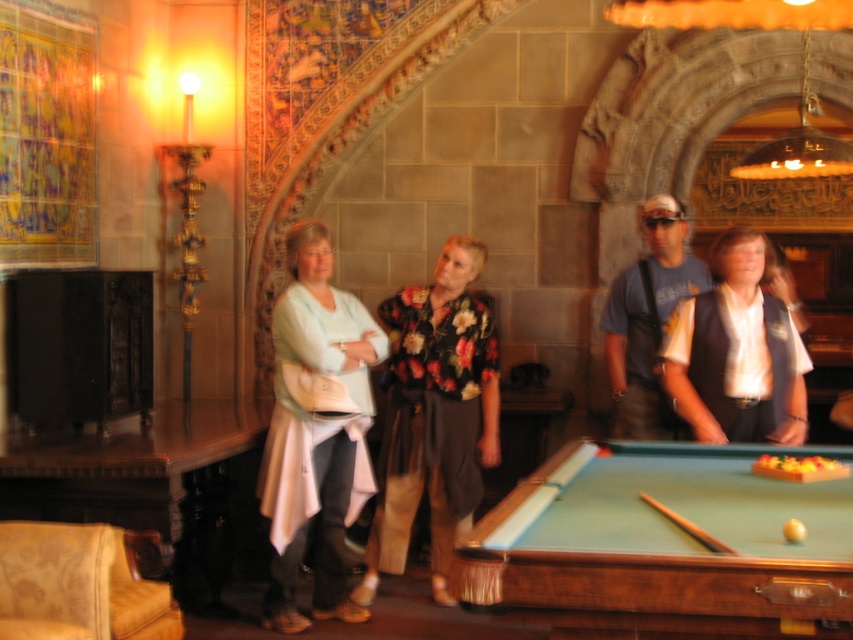
You are standing at the camera position and want to hand a cue stick to the person in the white shirt with vest at center. Can you reach them without moving?

The distance between you and the white shirt with vest at center is 3.99 meters, so you cannot reach them without moving closer.